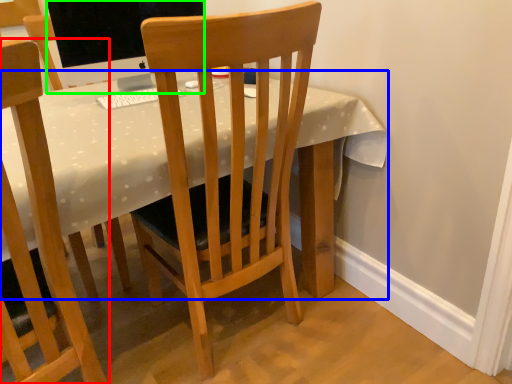
Question: Which object is the closest to the chair (highlighted by a red box)? Choose among these: desk (highlighted by a blue box) or television (highlighted by a green box).

Choices:
 (A) desk
 (B) television

Answer: (A)